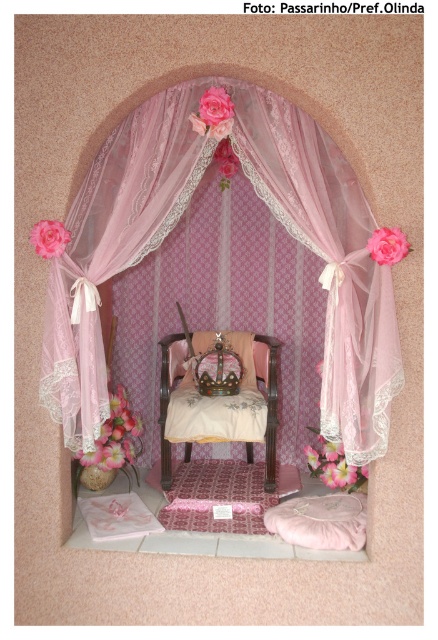
Question: Where is velvet cushion at center located in relation to matte pink rose at center in the image?

Choices:
 (A) left
 (B) right

Answer: (B)

Question: Which object is the farthest from the pink fabric flower at lower center?

Choices:
 (A) pink fabric flower at center
 (B) matte pink rose at center

Answer: (B)

Question: Can you confirm if pink lace flower at lower left is positioned to the right of pink fabric flower at upper center?

Choices:
 (A) yes
 (B) no

Answer: (B)

Question: Among these objects, which one is farthest from the camera?

Choices:
 (A) velvet gold chair at center
 (B) pink fabric flower at upper center
 (C) matte pink rose at center
 (D) pink fabric flower at center

Answer: (A)

Question: Which point is farther from the camera taking this photo?

Choices:
 (A) (59, 234)
 (B) (198, 113)
 (C) (364, 438)

Answer: (B)

Question: Can you confirm if pink fabric flower at center is bigger than pink fabric flower at upper center?

Choices:
 (A) yes
 (B) no

Answer: (A)